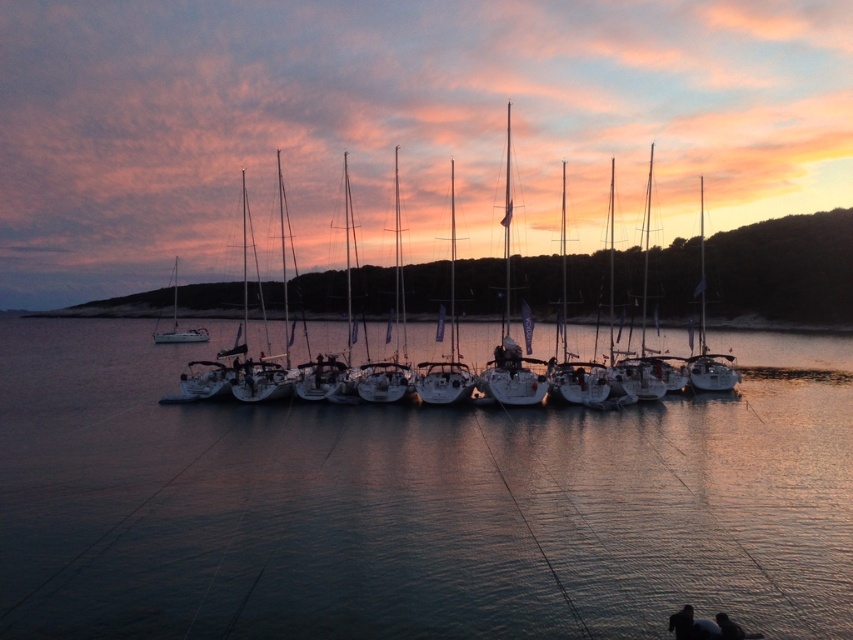
Question: Which point is closer to the camera?

Choices:
 (A) (175, 272)
 (B) (621, 401)
 (C) (535, 600)

Answer: (C)

Question: Is clear water at center positioned in front of white matte sailboat at left?

Choices:
 (A) yes
 (B) no

Answer: (A)

Question: Does clear water at center appear on the left side of white matte sailboat at left?

Choices:
 (A) yes
 (B) no

Answer: (B)

Question: Among these objects, which one is farthest from the camera?

Choices:
 (A) clear water at center
 (B) white matte sailboat at center

Answer: (B)

Question: Among these points, which one is farthest from the camera?

Choices:
 (A) (380, 611)
 (B) (432, 387)
 (C) (184, 330)

Answer: (C)

Question: Is clear water at center positioned in front of white matte sailboat at center?

Choices:
 (A) yes
 (B) no

Answer: (A)